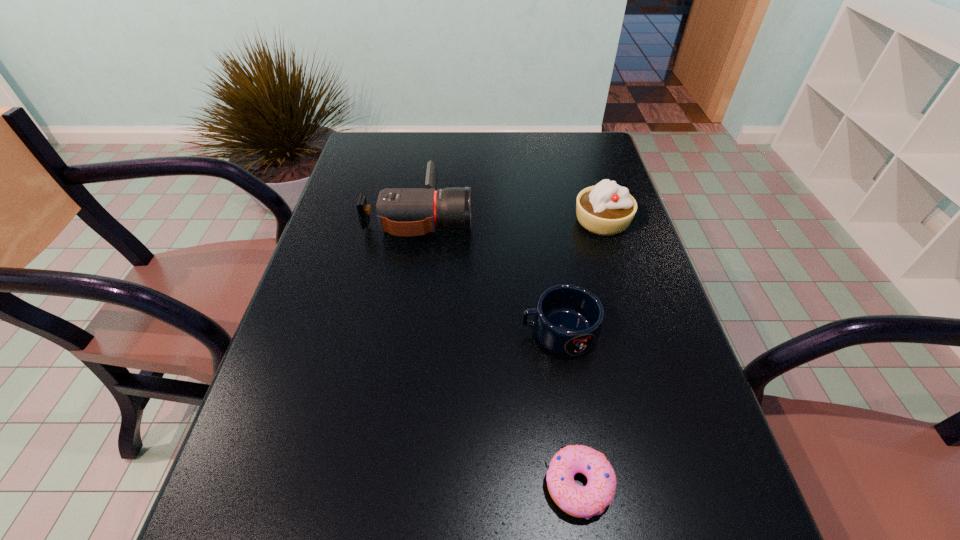
This screenshot has height=540, width=960. What are the coordinates of `vacant point located between the shortest object and the second shortest object` in the screenshot? It's located at (568, 408).

In order to click on free space between the whipped cream and the second nearest object in this screenshot , I will do `click(581, 276)`.

In order to click on free point between the shortest object and the second nearest object in this screenshot , I will do `click(568, 408)`.

The image size is (960, 540). Find the location of `free spot between the leftmost object and the rightmost object`. free spot between the leftmost object and the rightmost object is located at coordinates (511, 219).

You are a GUI agent. You are given a task and a screenshot of the screen. Output one action in this format:
    pyautogui.click(x=<x>, y=<y>)
    Task: Click on the empty location between the mug and the camcorder
    The width and height of the screenshot is (960, 540).
    Given the screenshot: What is the action you would take?
    pyautogui.click(x=489, y=274)

Identify the location of free space between the whipped cream and the doughnut. (590, 353).

At what (x,y) coordinates should I click in order to perform the action: click on free area in between the mug and the shortest object. Please return your answer as a coordinate pair (x, y). The width and height of the screenshot is (960, 540). Looking at the image, I should click on (568, 408).

Where is `vacant area that lies between the shortest object and the rightmost object`? The width and height of the screenshot is (960, 540). vacant area that lies between the shortest object and the rightmost object is located at coordinates (590, 353).

Where is `free space between the third tallest object and the nearest object`? free space between the third tallest object and the nearest object is located at coordinates (568, 408).

Locate which object is the second closest to the shortest object. Please provide its 2D coordinates. Your answer should be formatted as a tuple, i.e. [(x, y)], where the tuple contains the x and y coordinates of a point satisfying the conditions above.

[(400, 211)]